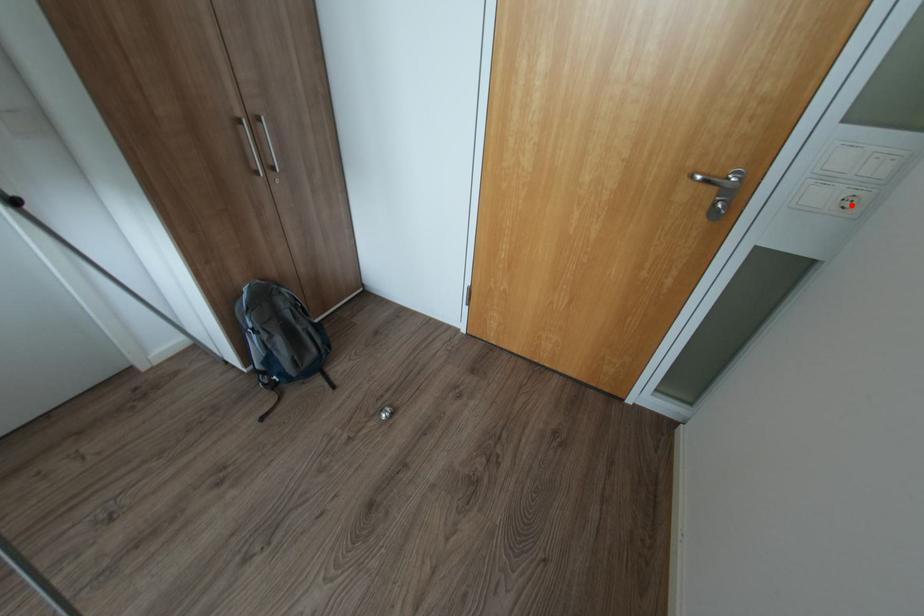
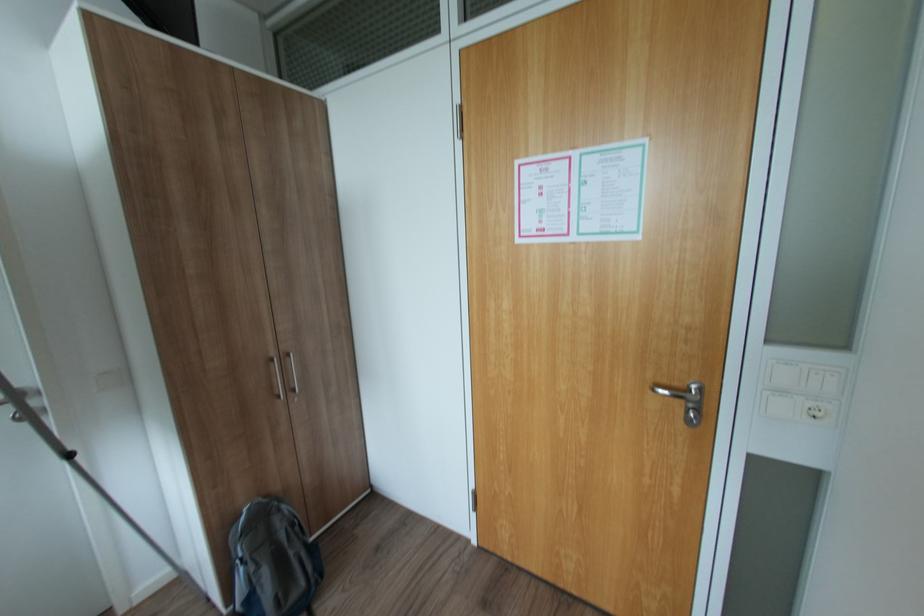
In the second image, find the point that corresponds to the highlighted location in the first image.

(820, 414)